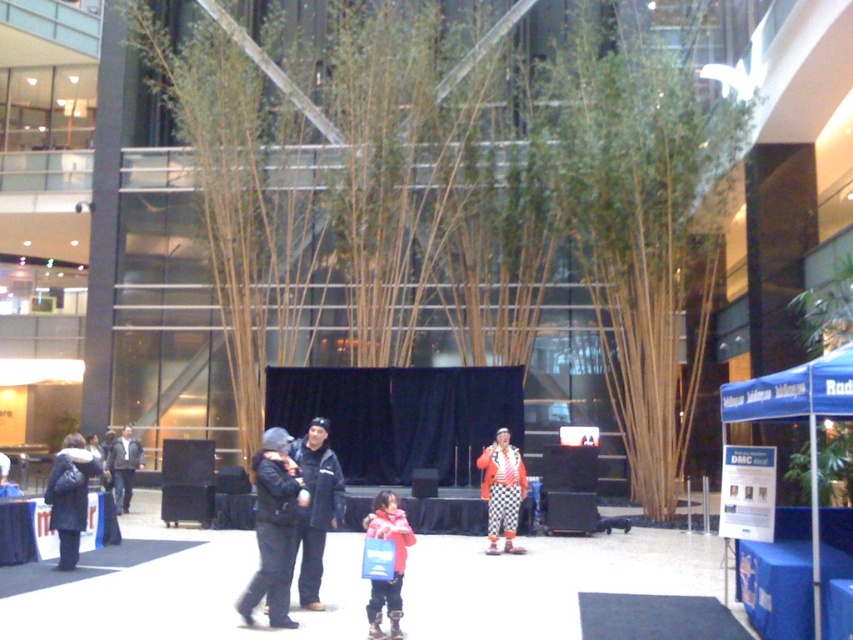
Is point (657, 436) behind point (85, 518)?

Yes.

Find the location of a particular element. The image size is (853, 640). brown wood tree at center is located at coordinates (645, 220).

Is black fuzzy jacket at center smaller than orange and white checkered clown costume at center?

Indeed, black fuzzy jacket at center has a smaller size compared to orange and white checkered clown costume at center.

Which is more to the left, black fuzzy jacket at center or orange and white checkered clown costume at center?

black fuzzy jacket at center is more to the left.

Is point (242, 618) more distant than point (508, 467)?

No, it is in front of (508, 467).

The height and width of the screenshot is (640, 853). Find the location of `black fuzzy jacket at center`. black fuzzy jacket at center is located at coordinates (273, 528).

Is point (94, 467) positioned before point (128, 481)?

That is True.

Locate an element on the screen. The width and height of the screenshot is (853, 640). matte black coat at left is located at coordinates (70, 496).